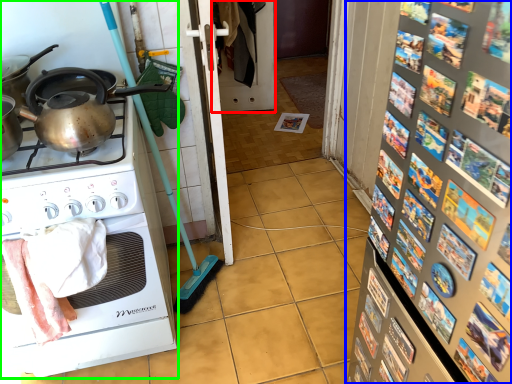
Question: Considering the real-world distances, which object is closest to screen door (highlighted by a red box)? bulletin board (highlighted by a blue box) or home appliance (highlighted by a green box).

Choices:
 (A) bulletin board
 (B) home appliance

Answer: (B)